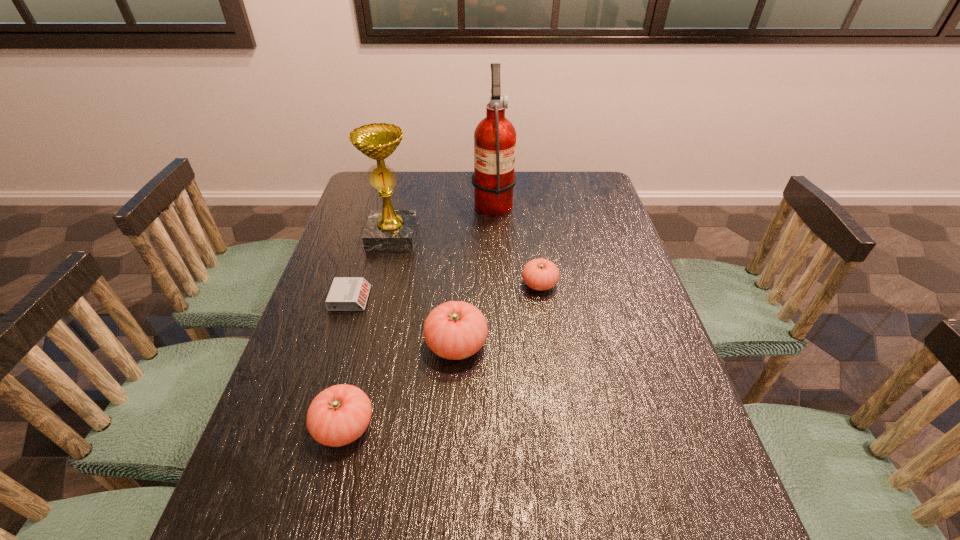
The height and width of the screenshot is (540, 960). I want to click on object at the near edge, so (x=340, y=414).

Locate an element on the screen. The height and width of the screenshot is (540, 960). tomato located in the left edge section of the desktop is located at coordinates 340,414.

Locate an element on the screen. The image size is (960, 540). award at the left edge is located at coordinates (388, 229).

This screenshot has height=540, width=960. I want to click on alarm clock located at the left edge, so click(346, 293).

This screenshot has height=540, width=960. In order to click on object that is at the near left corner in this screenshot , I will do `click(340, 414)`.

Image resolution: width=960 pixels, height=540 pixels. In order to click on free point at the far edge in this screenshot , I will do tap(529, 188).

You are a GUI agent. You are given a task and a screenshot of the screen. Output one action in this format:
    pyautogui.click(x=<x>, y=<y>)
    Task: Click on the free region at the near edge of the desktop
    
    Given the screenshot: What is the action you would take?
    pyautogui.click(x=360, y=485)

Locate an element on the screen. The image size is (960, 540). vacant point at the left edge is located at coordinates (339, 275).

I want to click on blank space at the right edge, so click(578, 241).

At what (x,y) coordinates should I click in order to perform the action: click on free spot between the fourth tallest object and the fifth farthest object. Please return your answer as a coordinate pair (x, y). The image size is (960, 540). Looking at the image, I should click on (400, 386).